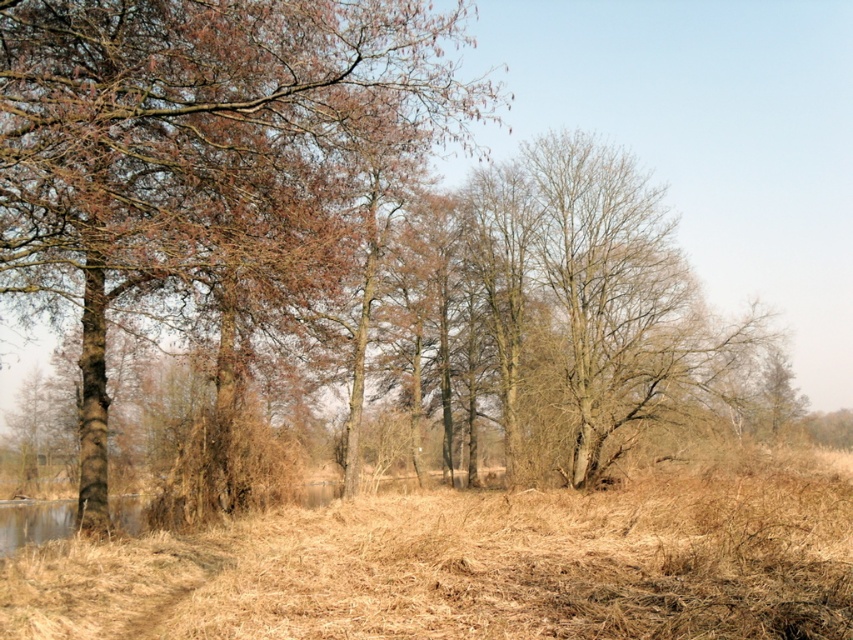
You are a hiker trying to cross the brown dry grass at center to reach a trail on the other side. There is a brown bark tree at left blocking your path. Can you walk around the tree to get to the grass?

The brown dry grass at center is behind the brown bark tree at left, so you can walk around the tree to access the grass since it is positioned behind the tree.